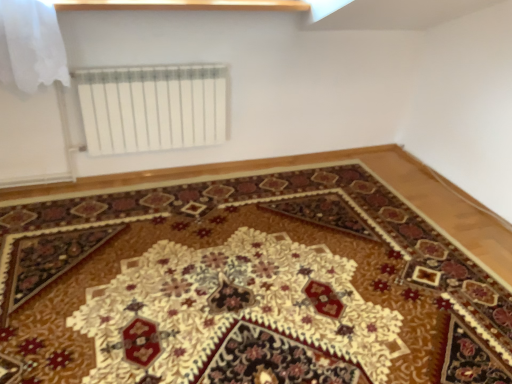
The image size is (512, 384). What do you see at coordinates (182, 5) in the screenshot?
I see `wooden at upper center` at bounding box center [182, 5].

Where is `wooden at upper center`? This screenshot has width=512, height=384. wooden at upper center is located at coordinates (182, 5).

This screenshot has height=384, width=512. I want to click on wooden at upper center, so click(x=182, y=5).